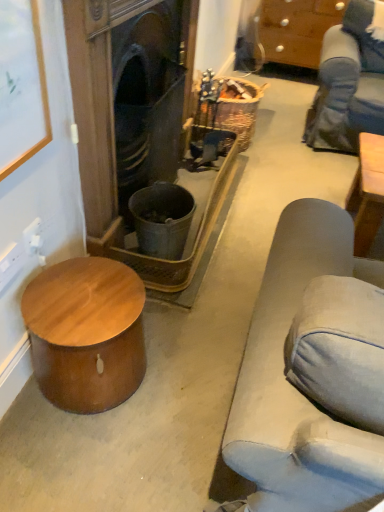
Question: Is brown wood cabinet at upper right bigger than wooden picture frame at upper left?

Choices:
 (A) yes
 (B) no

Answer: (A)

Question: Does brown wood cabinet at upper right appear on the left side of wooden picture frame at upper left?

Choices:
 (A) no
 (B) yes

Answer: (A)

Question: Considering the relative positions of brown wood cabinet at upper right and wooden picture frame at upper left in the image provided, is brown wood cabinet at upper right in front of wooden picture frame at upper left?

Choices:
 (A) no
 (B) yes

Answer: (A)

Question: Does brown wood cabinet at upper right have a smaller size compared to wooden picture frame at upper left?

Choices:
 (A) yes
 (B) no

Answer: (B)

Question: Can you confirm if brown wood cabinet at upper right is wider than wooden picture frame at upper left?

Choices:
 (A) no
 (B) yes

Answer: (B)

Question: From the image's perspective, does brown wood cabinet at upper right appear higher than wooden picture frame at upper left?

Choices:
 (A) no
 (B) yes

Answer: (B)

Question: Are wooden picture frame at upper left and dark wood fireplace at center making contact?

Choices:
 (A) no
 (B) yes

Answer: (A)

Question: From a real-world perspective, is wooden picture frame at upper left under dark wood fireplace at center?

Choices:
 (A) yes
 (B) no

Answer: (B)

Question: From the image's perspective, is wooden picture frame at upper left located beneath dark wood fireplace at center?

Choices:
 (A) yes
 (B) no

Answer: (A)

Question: Can you confirm if wooden picture frame at upper left is positioned to the left of dark wood fireplace at center?

Choices:
 (A) no
 (B) yes

Answer: (B)

Question: Is the position of wooden picture frame at upper left more distant than that of dark wood fireplace at center?

Choices:
 (A) yes
 (B) no

Answer: (B)

Question: Is wooden picture frame at upper left bigger than dark wood fireplace at center?

Choices:
 (A) yes
 (B) no

Answer: (B)

Question: From the image's perspective, is brown wood cabinet at upper right under wooden drum at lower left?

Choices:
 (A) no
 (B) yes

Answer: (A)